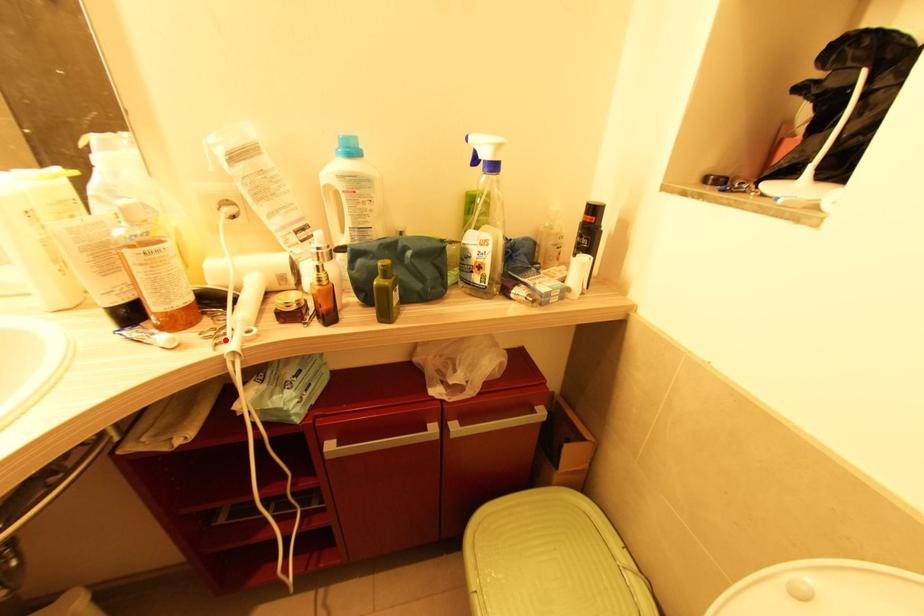
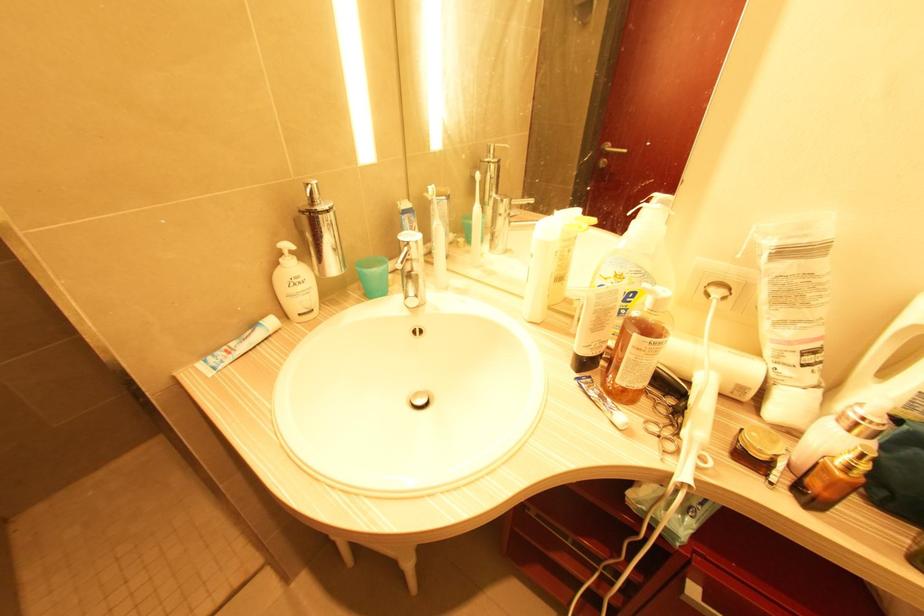
Locate, in the second image, the point that corresponds to the highlighted location in the first image.

(671, 448)